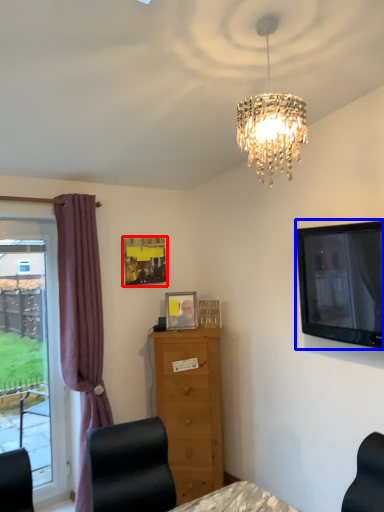
Question: Which of the following is the farthest to the observer, picture frame (highlighted by a red box) or television (highlighted by a blue box)?

Choices:
 (A) picture frame
 (B) television

Answer: (A)